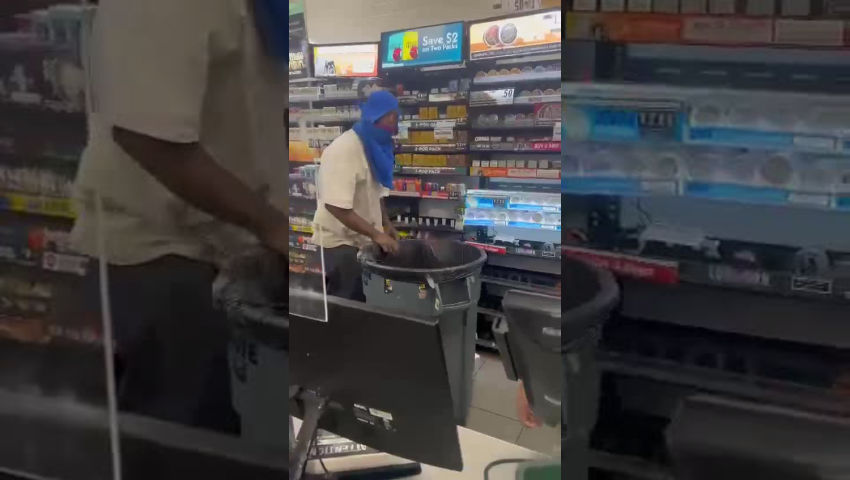
Locate an element on the screen. The height and width of the screenshot is (480, 850). computer monitor is located at coordinates (399, 352), (545, 352).